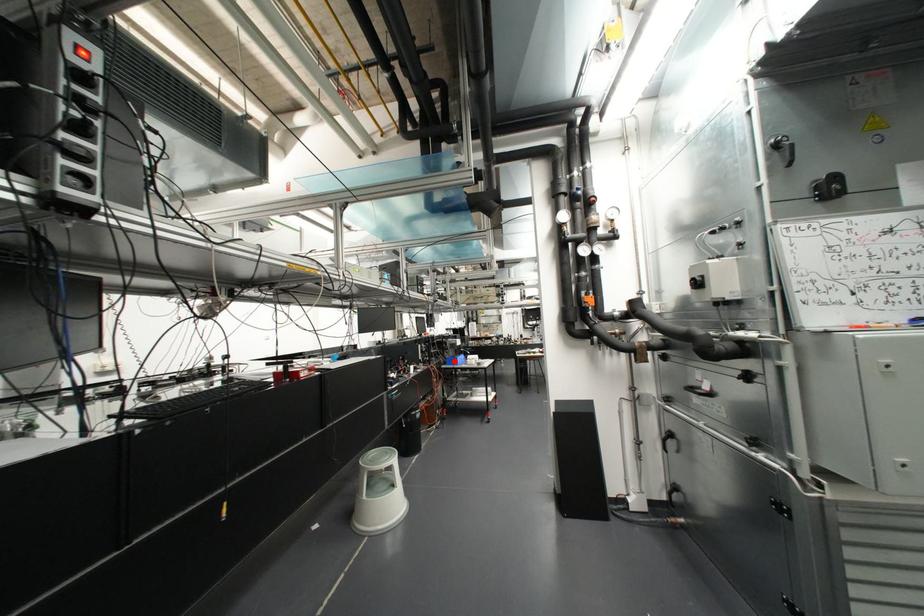
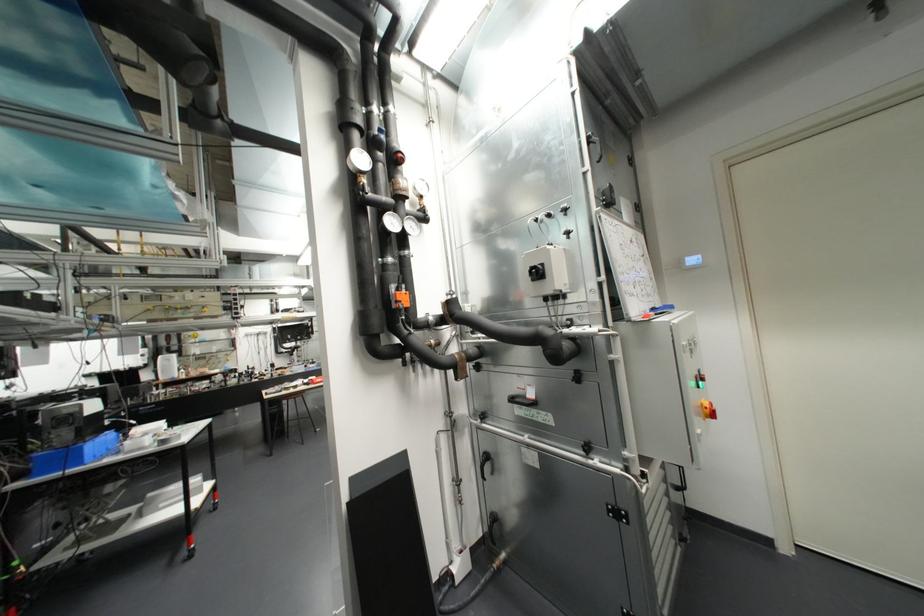
Question: I am providing you with two images of the same scene from different viewpoints. Image1 has a red point marked. In image2, the corresponding 3D location appears at what relative position? Reply with the corresponding letter.

Choices:
 (A) Closer
 (B) Farther

Answer: (A)